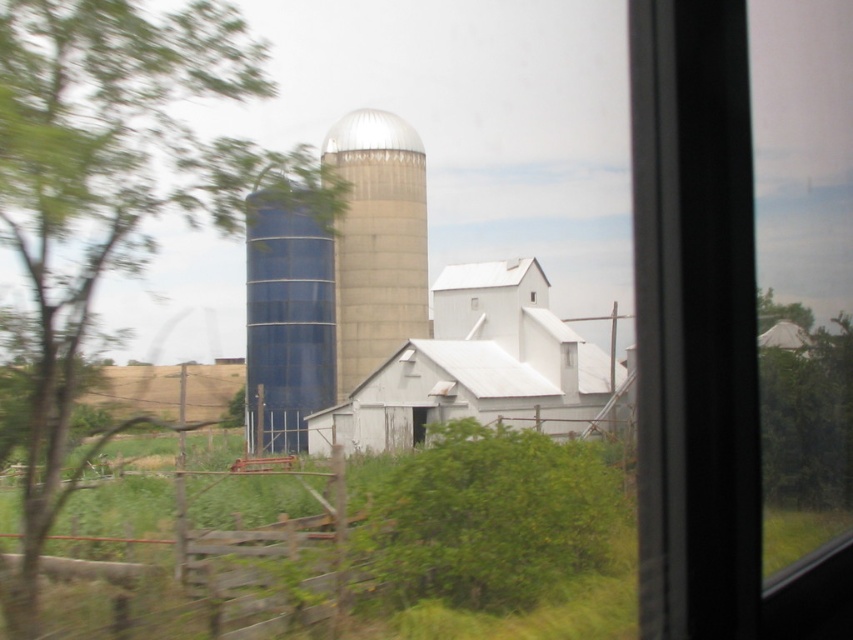
You are standing in a room looking through a window at a farm scene. You notice two points marked in the image. The first point is at coordinate (177, 90) and the second is at (329, 365). Which point is closer to you through the window?

The point at coordinate (177, 90) is closer to you through the window than the point at (329, 365).